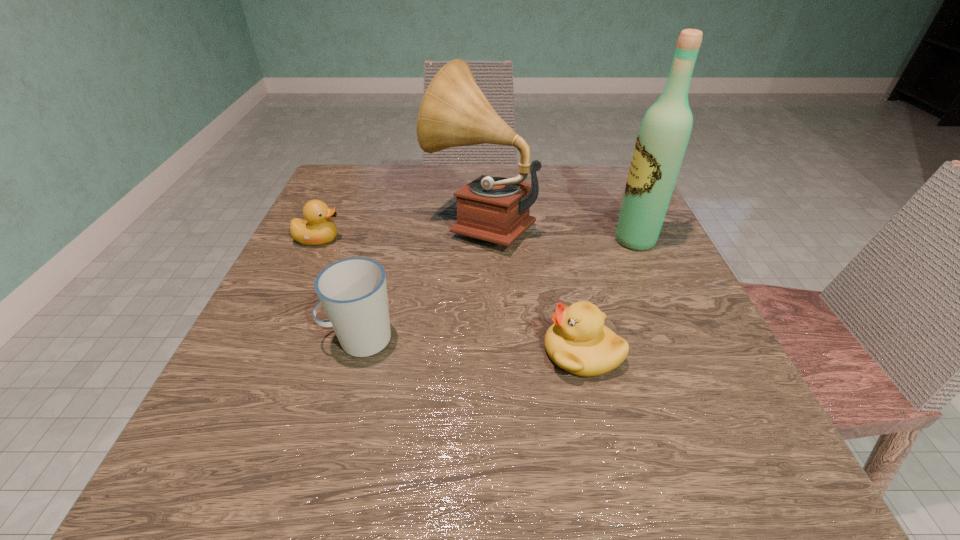
At what (x,y) coordinates should I click in order to perform the action: click on vacant space at the near right corner. Please return your answer as a coordinate pair (x, y). The image size is (960, 540). Looking at the image, I should click on (696, 431).

This screenshot has height=540, width=960. Identify the location of vacant area between the fourth shortest object and the third tallest object. (420, 280).

Find the location of a particular element. The height and width of the screenshot is (540, 960). free point between the nearer duckling and the leftmost object is located at coordinates (450, 296).

The image size is (960, 540). Find the location of `free space between the rightmost object and the fourth shortest object`. free space between the rightmost object and the fourth shortest object is located at coordinates (558, 231).

Identify the location of free space between the wine bottle and the nearer duckling. (609, 296).

You are a GUI agent. You are given a task and a screenshot of the screen. Output one action in this format:
    pyautogui.click(x=<x>, y=<y>)
    Task: Click on the free space between the second tallest object and the third tallest object
    
    Given the screenshot: What is the action you would take?
    pyautogui.click(x=420, y=280)

At what (x,y) coordinates should I click in order to perform the action: click on free spot between the left duckling and the wine bottle. Please return your answer as a coordinate pair (x, y). Looking at the image, I should click on (477, 240).

Identify the location of empty space between the right duckling and the tallest object. Image resolution: width=960 pixels, height=540 pixels. (609, 296).

Locate an element on the screen. This screenshot has height=540, width=960. empty space between the nearer duckling and the tallest object is located at coordinates (609, 296).

I want to click on free space between the phonograph record and the left duckling, so click(399, 230).